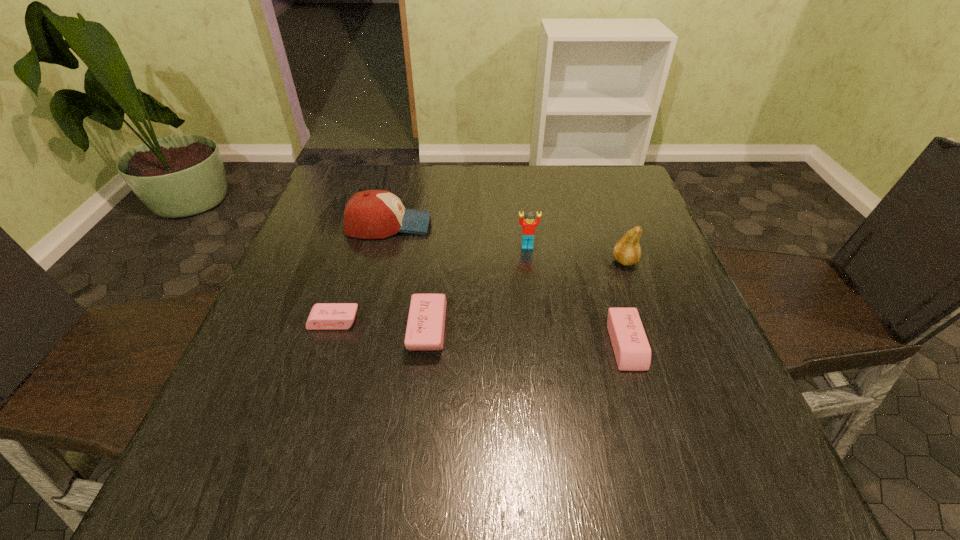
Please determine a free point for an extra eraser to ensure balance. Please provide its 2D coordinates. Your answer should be formatted as a tuple, i.e. [(x, y)], where the tuple contains the x and y coordinates of a point satisfying the conditions above.

[(525, 337)]